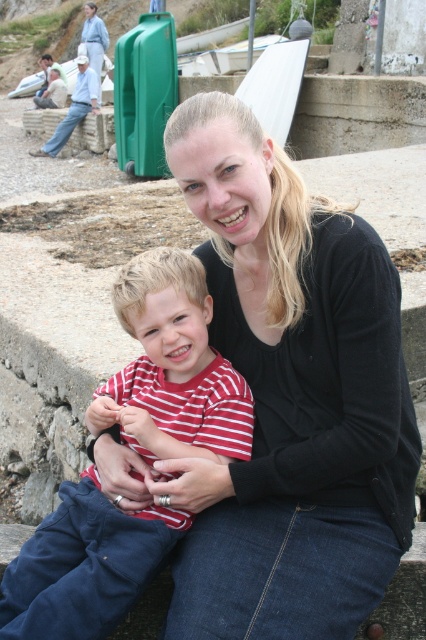
You are a photographer trying to capture a closeup of the black matte sweater at center and the striped fabric shirt at center. Which one should you focus on first if you want to ensure both are in focus without adjusting the camera settings?

The black matte sweater at center is taller than the striped fabric shirt at center, so focusing on the black matte sweater at center first would help ensure both are in focus since it is larger in the frame.

The woman is wearing a black matte sweater at center and the child is wearing a striped fabric shirt at center. Which clothing item is covering the other?

The black matte sweater at center is positioned over the striped fabric shirt at center, so it is covering it.

You are a photographer trying to capture a closeup shot of the black matte sweater at center and the striped fabric shirt at center. Given that your camera can only focus on objects within 8 inches of each other, will you be able to get a clear shot of both items?

The distance between the black matte sweater at center and striped fabric shirt at center is 8.87 inches. Since the camera requires objects to be within 8 inches for clear focus, the 8.87 inches distance exceeds this limit, so the camera cannot focus both items clearly at the same time.